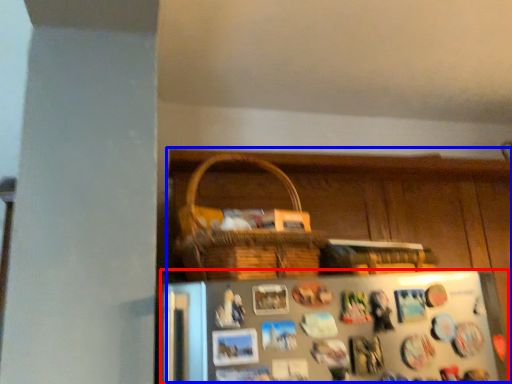
Question: Which point is closer to the camera, refrigerator (highlighted by a red box) or dresser (highlighted by a blue box)?

Choices:
 (A) refrigerator
 (B) dresser

Answer: (A)